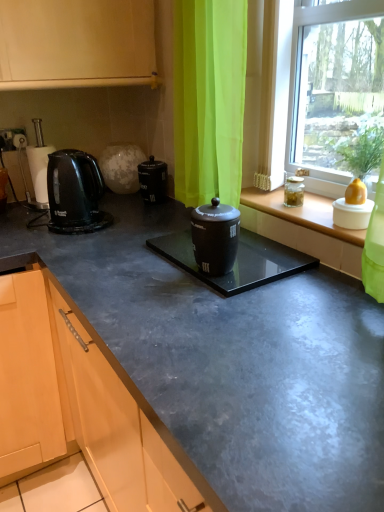
Identify the location of matte black coffee canister at center. The image size is (384, 512). (121, 425).

This screenshot has width=384, height=512. I want to click on transparent glass window at center, so click(334, 89).

Describe the element at coordinates (39, 164) in the screenshot. The width and height of the screenshot is (384, 512). I see `black plastic kettle at left` at that location.

Find the location of a particular element. matte black coffee canister at center is located at coordinates (121, 425).

Which is behind, point (334, 119) or point (320, 200)?

Positioned behind is point (320, 200).

Who is more distant, transparent glass window at center or matte glass window sill at center?

matte glass window sill at center.

Which object is positioned more to the left, transparent glass window at center or matte glass window sill at center?

Positioned to the left is matte glass window sill at center.

From a real-world perspective, relative to matte glass window sill at center, is transparent glass window at center vertically above or below?

transparent glass window at center is situated higher than matte glass window sill at center in the real world.

From a real-world perspective, who is located lower, transparent glass window at center or black plastic kettle at left?

black plastic kettle at left.

Choose the correct answer: Is transparent glass window at center inside black plastic kettle at left or outside it?

transparent glass window at center lies outside black plastic kettle at left.

Is transparent glass window at center taller than black plastic kettle at left?

Correct, transparent glass window at center is much taller as black plastic kettle at left.

From the image's perspective, is transparent glass window at center under black plastic kettle at left?

No, from the image's perspective, transparent glass window at center is not below black plastic kettle at left.

Which is in front, point (180, 233) or point (101, 222)?

The point (180, 233) is in front.

Could you tell me if black glossy container at center is turned towards black glossy electric kettle at left?

No, black glossy container at center is not facing towards black glossy electric kettle at left.

At what (x,y) coordinates should I click in order to perform the action: click on home appliance behind the black glossy container at center. Please return your answer as a coordinate pair (x, y). This screenshot has height=512, width=384. Looking at the image, I should click on (75, 193).

Which of these two, matte black coffee canister at center or black plastic kettle at left, is thinner?

With smaller width is black plastic kettle at left.

Is matte black coffee canister at center surrounding black plastic kettle at left?

That's incorrect, black plastic kettle at left is not inside matte black coffee canister at center.

Does point (129, 452) come farther from viewer compared to point (33, 165)?

That is False.

Between matte black coffee canister at center and black plastic kettle at left, which one is positioned behind?

black plastic kettle at left is more distant.

Choose the correct answer: Is black glossy electric kettle at left inside black glossy container at center or outside it?

black glossy electric kettle at left is outside black glossy container at center.

Is black glossy electric kettle at left not near black glossy container at center?

Actually, black glossy electric kettle at left and black glossy container at center are a little close together.

Is black glossy electric kettle at left facing away from black glossy container at center?

No, black glossy electric kettle at left's orientation is not away from black glossy container at center.

Is black glossy electric kettle at left taller or shorter than black glossy container at center?

In the image, black glossy electric kettle at left appears to be taller than black glossy container at center.

Does matte glass window sill at center turn towards transparent glass window at center?

No, matte glass window sill at center is not aimed at transparent glass window at center.

Would you consider matte glass window sill at center to be distant from transparent glass window at center?

No, matte glass window sill at center is not far away from transparent glass window at center.

In the scene shown: From the image's perspective, does matte glass window sill at center appear higher than transparent glass window at center?

No, from the image's perspective, matte glass window sill at center is not on top of transparent glass window at center.

How far apart are matte glass window sill at center and transparent glass window at center?

matte glass window sill at center and transparent glass window at center are 10.70 inches apart from each other.

Is transparent glass window at center facing away from black glossy electric kettle at left?

That's not correct — transparent glass window at center is not looking away from black glossy electric kettle at left.

From the image's perspective, would you say transparent glass window at center is positioned over black glossy electric kettle at left?

Yes, from the image's perspective, transparent glass window at center is above black glossy electric kettle at left.

Considering the relative positions of transparent glass window at center and black glossy electric kettle at left in the image provided, is transparent glass window at center in front of black glossy electric kettle at left?

Yes, it is.

Identify the location of window sill that appears behind the transparent glass window at center. The width and height of the screenshot is (384, 512). (302, 213).

The image size is (384, 512). I want to click on window that is above the black plastic kettle at left (from the image's perspective), so click(334, 89).

In the scene shown: Which object lies further to the anchor point transparent glass window at center, matte black coffee canister at center or black glossy electric kettle at left?

matte black coffee canister at center is positioned further to the anchor transparent glass window at center.

Considering their positions, is transparent glass window at center positioned further to matte glass window sill at center than black plastic kettle at left?

black plastic kettle at left lies further to matte glass window sill at center than the other object.

Consider the image. Looking at the image, which one is located closer to matte glass window sill at center, black plastic kettle at left or black glossy electric kettle at left?

black glossy electric kettle at left.

When comparing their distances from black glossy electric kettle at left, does matte black coffee canister at center or matte glass window sill at center seem further?

Among the two, matte glass window sill at center is located further to black glossy electric kettle at left.

Which object lies nearer to the anchor point matte black coffee canister at center, matte glass window sill at center or transparent glass window at center?

matte glass window sill at center lies closer to matte black coffee canister at center than the other object.

When comparing their distances from matte black coffee canister at center, does black glossy electric kettle at left or black plastic kettle at left seem closer?

Among the two, black glossy electric kettle at left is located nearer to matte black coffee canister at center.

Estimate the real-world distances between objects in this image. Which object is closer to black glossy container at center, transparent glass window at center or matte glass window sill at center?

Based on the image, matte glass window sill at center appears to be nearer to black glossy container at center.

Estimate the real-world distances between objects in this image. Which object is closer to matte black coffee canister at center, black glossy electric kettle at left or black glossy container at center?

The object closer to matte black coffee canister at center is black glossy container at center.

Locate an element on the screen. The width and height of the screenshot is (384, 512). home appliance located between matte black coffee canister at center and transparent glass window at center in the left-right direction is located at coordinates (75, 193).

You are a GUI agent. You are given a task and a screenshot of the screen. Output one action in this format:
    pyautogui.click(x=<x>, y=<y>)
    Task: Click on the sink situated between matte black coffee canister at center and transparent glass window at center from left to right
    
    Given the screenshot: What is the action you would take?
    pyautogui.click(x=237, y=261)

The image size is (384, 512). I want to click on home appliance located between matte black coffee canister at center and black glossy container at center in the left-right direction, so click(x=75, y=193).

Locate an element on the screen. This screenshot has width=384, height=512. window sill between black glossy electric kettle at left and transparent glass window at center in the horizontal direction is located at coordinates point(302,213).